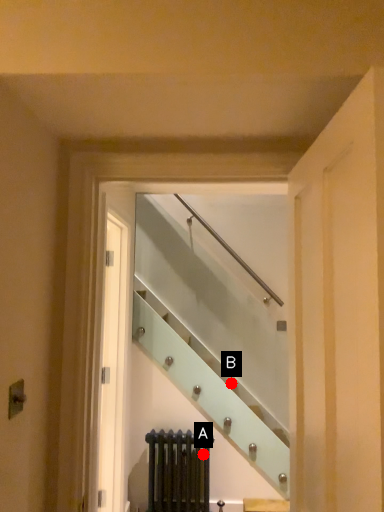
Question: Two points are circled on the image, labeled by A and B beside each circle. Which of the following is the closest to the observer?

Choices:
 (A) A is closer
 (B) B is closer

Answer: (A)